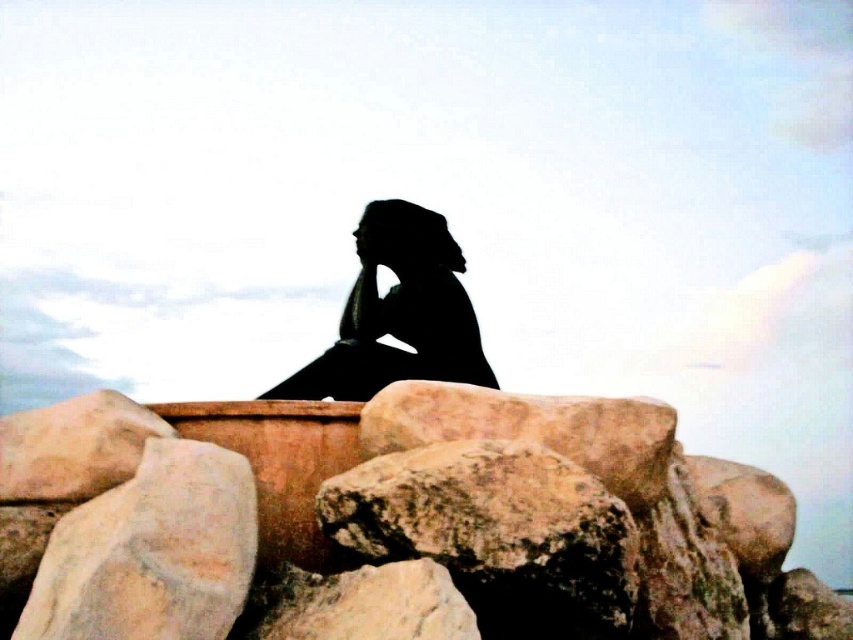
You are standing at the origin point of the image coordinate system, which is the bottom left corner. You want to place a small flag exactly at the location of the rustic stone at lower left. What are the coordinates where you should place the flag?

The coordinates for the rustic stone at lower left are at point (151, 552), so you should place the flag at those coordinates.

You are a photographer setting up a shot of the rustic stone at lower left and the black matte figure at center. Which object should you focus on first if you want to capture both in sharp focus, considering their sizes?

The rustic stone at lower left is thinner than the black matte figure at center, so you should focus on the black matte figure at center first since it is larger and will require more precise focusing to ensure sharpness.

You are standing at the base of the rocks in the scene and want to place a small flag at the point that is closer to you. Which point should you choose between point (178, 499) and point (440, 376)?

Point (178, 499) is in front of point (440, 376), so you should place the flag at point (178, 499) since it is closer to you.